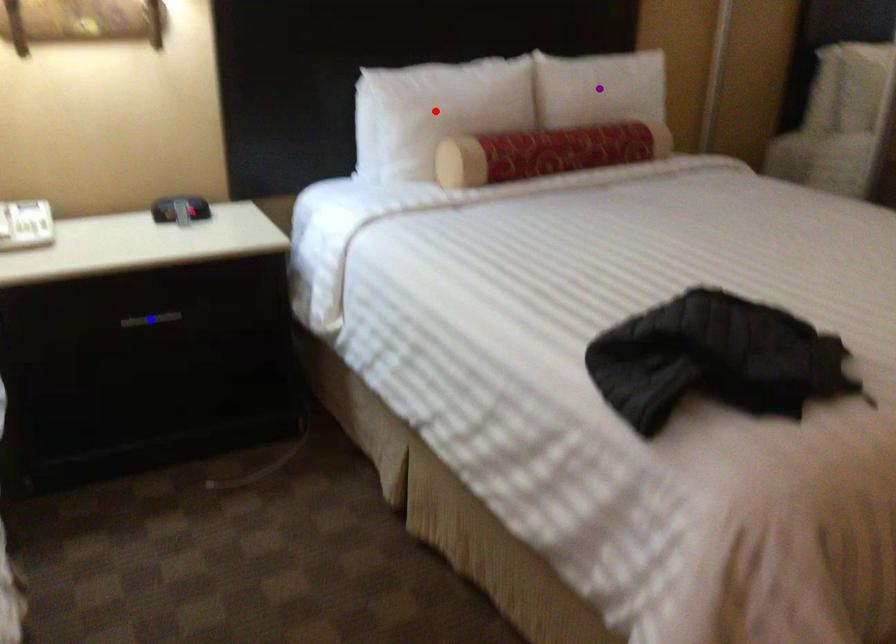
Order these from nearest to farthest:
red point, blue point, purple point

blue point → red point → purple point